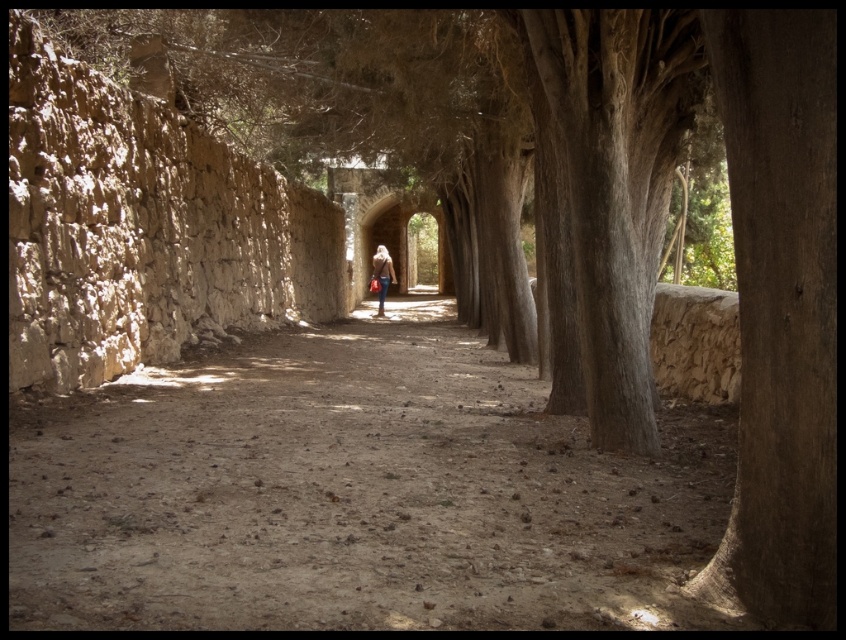
Which is below, dirt ground at center or denim jacket at center?

Positioned lower is dirt ground at center.

Is dirt ground at center above denim jacket at center?

No, dirt ground at center is not above denim jacket at center.

Which is in front, point (419, 490) or point (378, 305)?

Point (419, 490) is in front.

Locate an element on the screen. This screenshot has width=846, height=640. dirt ground at center is located at coordinates (354, 493).